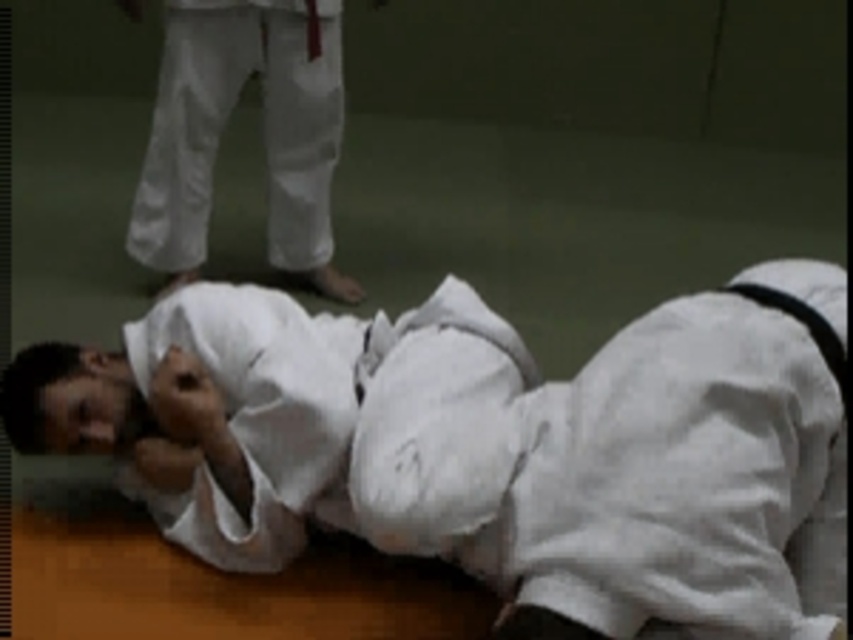
Question: Is white cloth kimono at lower left wider than white cotton pants at upper center?

Choices:
 (A) yes
 (B) no

Answer: (A)

Question: Among these objects, which one is nearest to the camera?

Choices:
 (A) white cotton pants at upper center
 (B) white cloth kimono at lower left

Answer: (B)

Question: Does white cloth kimono at lower left come in front of white cotton pants at upper center?

Choices:
 (A) yes
 (B) no

Answer: (A)

Question: Is white cloth kimono at lower left bigger than white cotton pants at upper center?

Choices:
 (A) yes
 (B) no

Answer: (A)